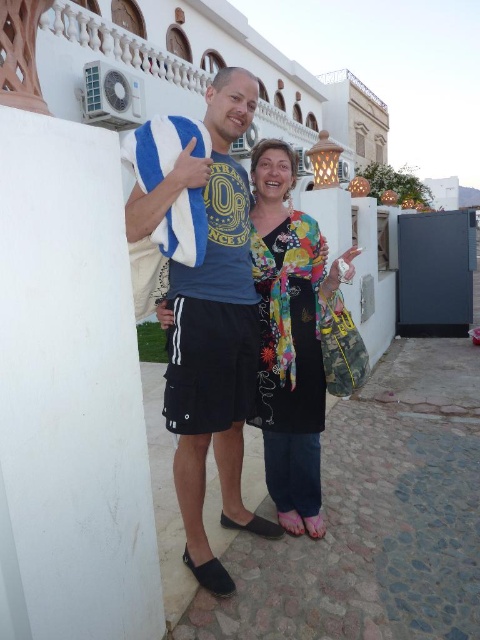
Is blue striped towel at center taller than floral-patterned fabric at center?

Yes, blue striped towel at center is taller than floral-patterned fabric at center.

Which is below, blue striped towel at center or floral-patterned fabric at center?

floral-patterned fabric at center is below.

From the picture: Who is more forward, (171, 344) or (300, 435)?

Positioned in front is point (171, 344).

Where is `blue striped towel at center`? The width and height of the screenshot is (480, 640). blue striped towel at center is located at coordinates pyautogui.click(x=211, y=324).